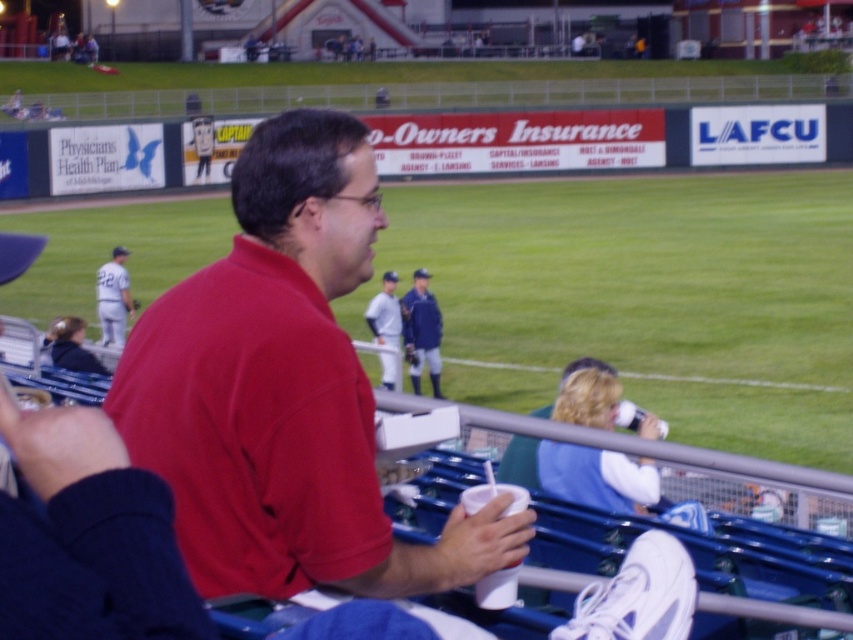
Is white uniform at left positioned before white jersey at center?

No, it is not.

Where is `white uniform at left`? The width and height of the screenshot is (853, 640). white uniform at left is located at coordinates (113, 298).

Identify the location of white uniform at left. (113, 298).

Which is behind, point (410, 380) or point (103, 316)?

Positioned behind is point (103, 316).

Where is `blue fabric jacket at center`? blue fabric jacket at center is located at coordinates (421, 332).

Does matte red shirt at center lie behind white jersey at center?

No, matte red shirt at center is in front of white jersey at center.

Who is positioned more to the left, matte red shirt at center or white jersey at center?

white jersey at center

Which is behind, point (256, 493) or point (386, 300)?

Positioned behind is point (386, 300).

This screenshot has width=853, height=640. In order to click on matte red shirt at center in this screenshot , I will do `click(283, 390)`.